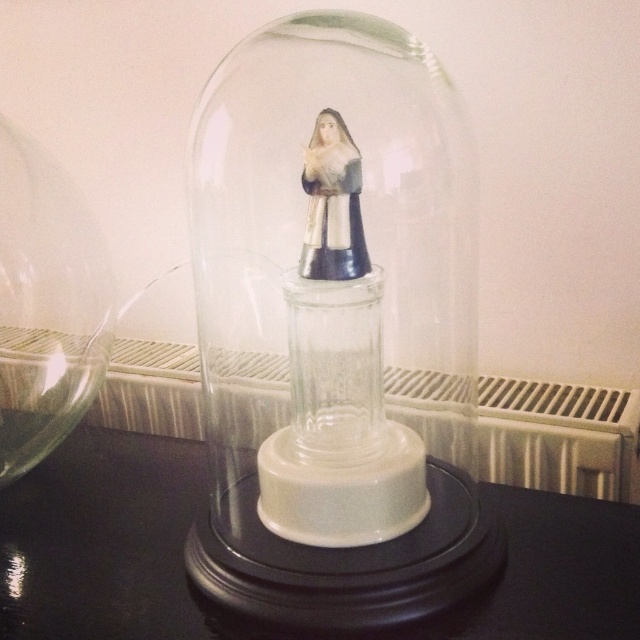
You are an interior designer planning to place a 18 inch wide decorative item on the floor between the white textured radiator at center and the matte silver statue at center. Is there enough space for it?

The distance between the white textured radiator at center and the matte silver statue at center is 20.10 inches. Since the decorative item is 18 inches wide, there is enough space to place it between them.

You are standing in front of a glass dome containing a figurine of a person in traditional attire. The dome is mounted on a black glossy table at center. If you want to place a book that is 80 centimeters long on the table, will there be enough space between you and the table to safely place the book without touching it?

The distance between you and the black glossy table at center is 82.07 centimeters. Since the book is 80 centimeters long, there is sufficient space to place the book on the table without touching it.

You are an interior designer planning to place a new rectangular table between the transparent glass vase at left and the white textured radiator at center. The table must be 1.2 meters wide. Can the space between them accommodate this table?

The transparent glass vase at left is narrower than the white textured radiator at center. However, the exact distance between them isn not specified in the provided information. Without knowing the actual spacing between the two objects, it is impossible to determine if the 1.2 meter wide table will fit. Additional measurements are needed to confirm the available space.